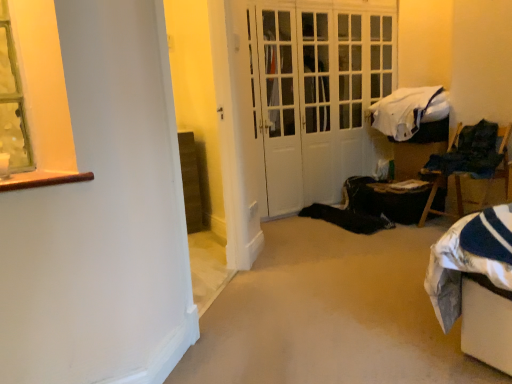
What is the approximate width of black fabric bag at lower right?

It is 20.54 inches.

What do you see at coordinates (311, 97) in the screenshot?
I see `white glossy door at center` at bounding box center [311, 97].

Locate an element on the screen. The height and width of the screenshot is (384, 512). white glossy door at center is located at coordinates (311, 97).

Locate an element on the screen. white soft blanket at upper right is located at coordinates (409, 111).

Image resolution: width=512 pixels, height=384 pixels. Identify the location of black fabric bag at lower right. [x=385, y=200].

Is white soft blanket at upper right oriented towards black fabric bag at lower right?

No, white soft blanket at upper right is not oriented towards black fabric bag at lower right.

Where is `table located in front of the white soft blanket at upper right`? The width and height of the screenshot is (512, 384). table located in front of the white soft blanket at upper right is located at coordinates (385, 200).

Is white soft blanket at upper right next to black fabric bag at lower right?

No, white soft blanket at upper right is not in contact with black fabric bag at lower right.

Which is nearer, (x=394, y=105) or (x=440, y=192)?

The point (x=440, y=192) is closer.

Is white glossy door at center far away from wooden chair at right?

Absolutely, white glossy door at center is distant from wooden chair at right.

Is white glossy door at center facing away from wooden chair at right?

No, white glossy door at center is not facing away from wooden chair at right.

Who is bigger, white glossy door at center or wooden chair at right?

Bigger between the two is white glossy door at center.

Choose the correct answer: Is white glossy door at center inside wooden chair at right or outside it?

white glossy door at center cannot be found inside wooden chair at right.

From the image's perspective, would you say white glossy door at center is shown under white soft blanket at upper right?

Actually, white glossy door at center appears above white soft blanket at upper right in the image.

Which is behind, point (381, 72) or point (409, 128)?

Point (381, 72)

Would you say white glossy door at center is outside white soft blanket at upper right?

Yes, white glossy door at center is located beyond the bounds of white soft blanket at upper right.

Considering the sizes of objects white glossy door at center and white soft blanket at upper right in the image provided, who is bigger, white glossy door at center or white soft blanket at upper right?

With larger size is white glossy door at center.

From a real-world perspective, is white soft blanket at upper right positioned over wooden chair at right based on gravity?

Correct, in the physical world, white soft blanket at upper right is higher than wooden chair at right.

Considering the sizes of objects white soft blanket at upper right and wooden chair at right in the image provided, who is taller, white soft blanket at upper right or wooden chair at right?

With more height is wooden chair at right.

Which object is positioned more to the right, white soft blanket at upper right or wooden chair at right?

wooden chair at right.

Considering the positions of points (357, 201) and (405, 101), is point (357, 201) farther from camera compared to point (405, 101)?

Yes.

Where is `blanket that appears above the black fabric bag at lower right (from the image's perspective)`? blanket that appears above the black fabric bag at lower right (from the image's perspective) is located at coordinates [x=409, y=111].

Are black fabric bag at lower right and white soft blanket at upper right making contact?

No, black fabric bag at lower right is not touching white soft blanket at upper right.

From a real-world perspective, which is physically below, black fabric bag at lower right or white soft blanket at upper right?

black fabric bag at lower right.

Is wooden chair at right taller or shorter than black fabric bag at lower right?

wooden chair at right is taller than black fabric bag at lower right.

From the picture: Is wooden chair at right next to black fabric bag at lower right and touching it?

There is a gap between wooden chair at right and black fabric bag at lower right.

Which object is wider, wooden chair at right or black fabric bag at lower right?

black fabric bag at lower right.

I want to click on chair in front of the black fabric bag at lower right, so coord(435,194).

From a real-world perspective, who is located lower, white glossy door at center or black fabric bag at lower right?

black fabric bag at lower right, from a real-world perspective.

Consider the image. Between white glossy door at center and black fabric bag at lower right, which one has larger size?

white glossy door at center is bigger.

Is white glossy door at center far from black fabric bag at lower right?

No, white glossy door at center is not far away from black fabric bag at lower right.

Which point is more distant from viewer, (302, 206) or (358, 199)?

The point (302, 206) is behind.

At what (x,y) coordinates should I click in order to perform the action: click on table below the white soft blanket at upper right (from the image's perspective). Please return your answer as a coordinate pair (x, y). This screenshot has height=384, width=512. Looking at the image, I should click on (385, 200).

Where is `chair on the right of white glossy door at center`? chair on the right of white glossy door at center is located at coordinates (435, 194).

Estimate the real-world distances between objects in this image. Which object is closer to black fabric bag at lower right, white glossy door at center or wooden chair at right?

wooden chair at right is positioned closer to the anchor black fabric bag at lower right.

From the picture: Considering their positions, is white soft blanket at upper right positioned closer to black fabric bag at lower right than wooden chair at right?

Among the two, wooden chair at right is located nearer to black fabric bag at lower right.

Based on their spatial positions, is black fabric bag at lower right or white soft blanket at upper right closer to wooden chair at right?

The object closer to wooden chair at right is black fabric bag at lower right.

Based on their spatial positions, is white glossy door at center or white soft blanket at upper right further from black fabric bag at lower right?

white glossy door at center lies further to black fabric bag at lower right than the other object.

Looking at the image, which one is located further to white glossy door at center, wooden chair at right or black fabric bag at lower right?

The object further to white glossy door at center is wooden chair at right.

Which object lies nearer to the anchor point white soft blanket at upper right, wooden chair at right or black fabric bag at lower right?

wooden chair at right.

Consider the image. When comparing their distances from wooden chair at right, does white glossy door at center or white soft blanket at upper right seem further?

white glossy door at center.

When comparing their distances from wooden chair at right, does white soft blanket at upper right or white glossy door at center seem closer?

white soft blanket at upper right lies closer to wooden chair at right than the other object.

Locate an element on the screen. This screenshot has height=384, width=512. table situated between white glossy door at center and wooden chair at right from left to right is located at coordinates (385, 200).

I want to click on blanket situated between white glossy door at center and wooden chair at right from left to right, so coord(409,111).

Identify the location of chair that lies between white soft blanket at upper right and black fabric bag at lower right from top to bottom. This screenshot has height=384, width=512. (435, 194).

You are a GUI agent. You are given a task and a screenshot of the screen. Output one action in this format:
    pyautogui.click(x=<x>, y=<y>)
    Task: Click on the blanket between white glossy door at center and black fabric bag at lower right from top to bottom
    This screenshot has width=512, height=384.
    Given the screenshot: What is the action you would take?
    pyautogui.click(x=409, y=111)